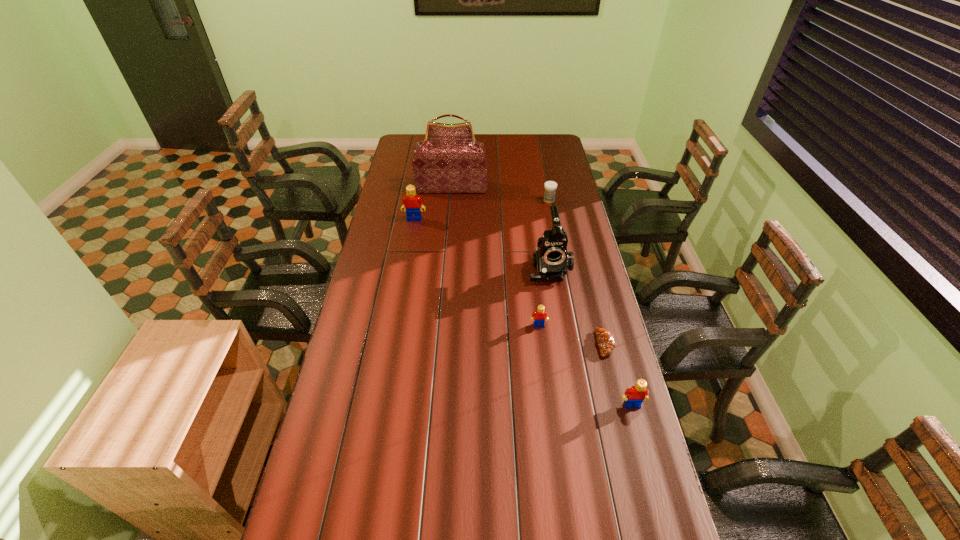
Where is `vacant area that satisfies the following two spatial constraints: 1. on the front-facing side of the crescent roll; 2. on the right side of the farthest object`? vacant area that satisfies the following two spatial constraints: 1. on the front-facing side of the crescent roll; 2. on the right side of the farthest object is located at coordinates (439, 344).

In order to click on vacant space that satisfies the following two spatial constraints: 1. on the lens mount of the crescent roll; 2. on the left side of the camcorder in this screenshot , I will do `click(562, 344)`.

At what (x,y) coordinates should I click in order to perform the action: click on vacant area in the image that satisfies the following two spatial constraints: 1. on the front-facing side of the farthest object; 2. on the right side of the sixth farthest object. Please return your answer as a coordinate pair (x, y). The image size is (960, 540). Looking at the image, I should click on (439, 344).